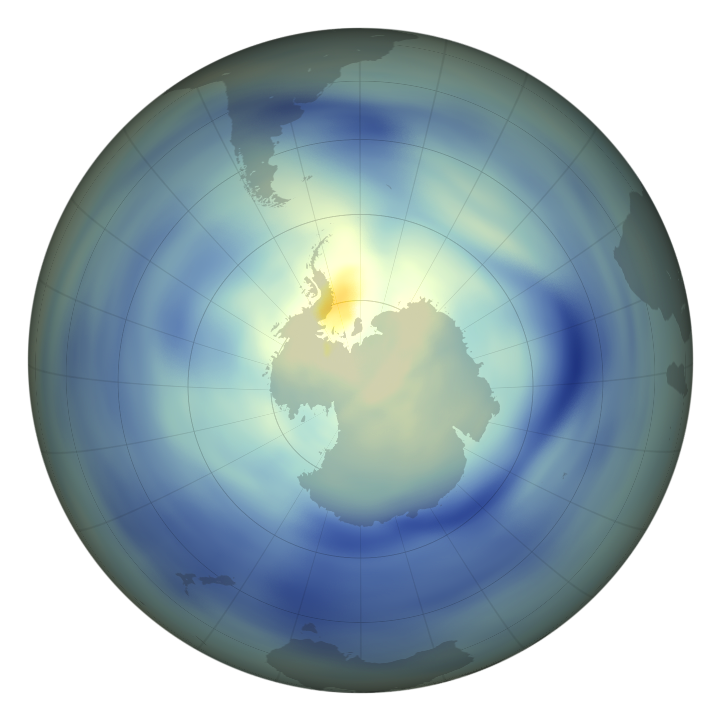
The height and width of the screenshot is (720, 720). What are the coordinates of `globe` in the screenshot? It's located at (364, 271).